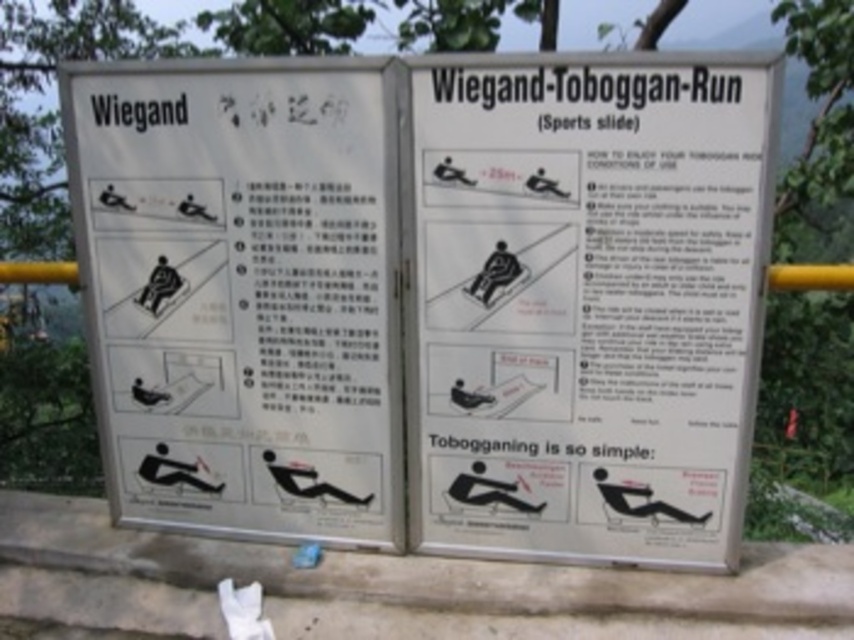
You are designing a new layout for the Wiegand Toboggan Run signboard and need to ensure proper spacing between the white paper sign at center and the white paper signage at upper left. Based on their sizes, which one should be placed closer to the edge to maintain balance?

The white paper sign at center has a smaller width compared to the white paper signage at upper left. To maintain balance, the smaller white paper sign at center should be placed closer to the edge, while the larger white paper signage at upper left should be positioned further inward.

You are standing in front of the Wiegand Toboggan Run signboard. You need to read the instructions. Which of the two white paper signs, the white paper sign at center or the white paper signage at upper left, is closer to you?

The white paper sign at center is closer to you because it is in front of the white paper signage at upper left.